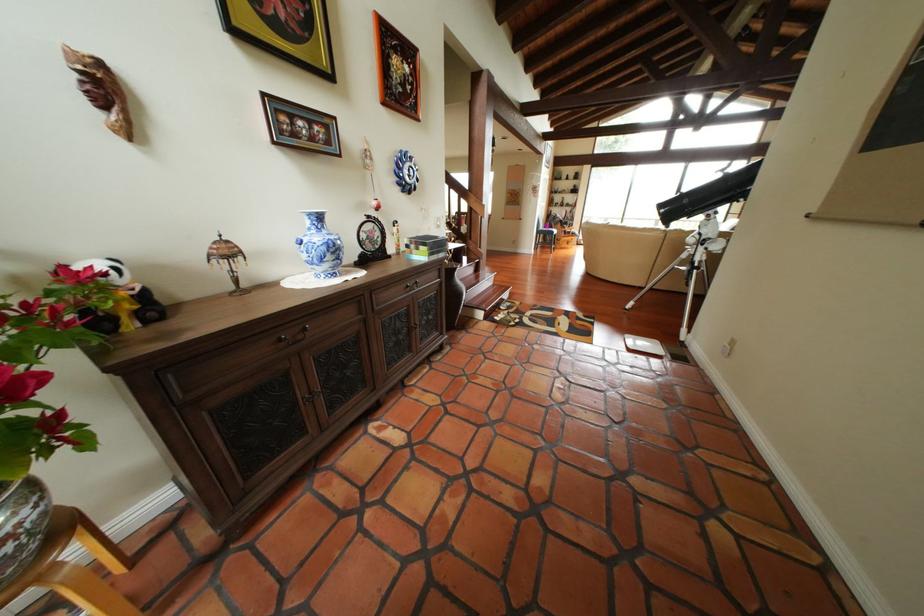
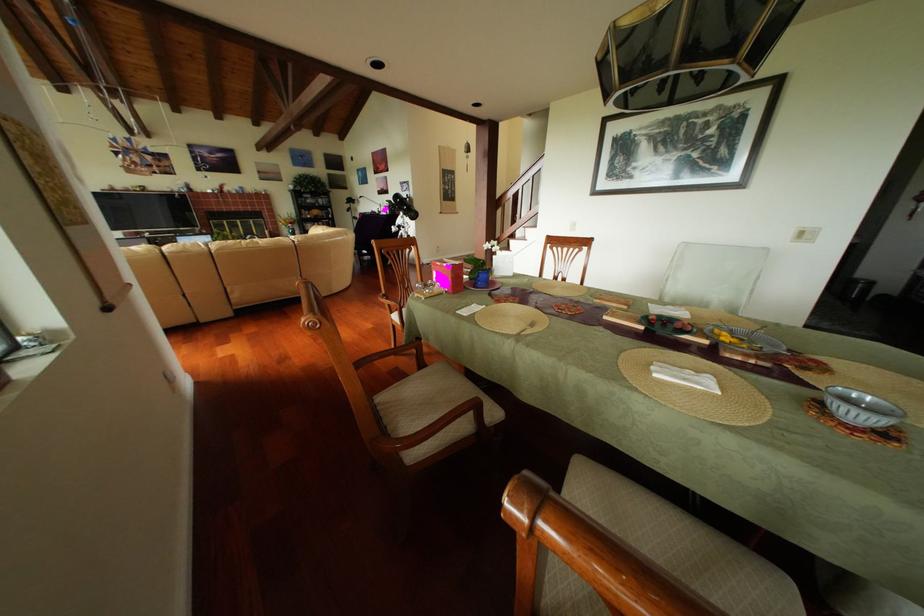
Question: I am providing you with two images of the same scene from different viewpoints. After the viewpoint changes to image2, which objects are now occluded?

Choices:
 (A) dark cabinet knob
 (B) wooden chair armrest
 (C) blue flower pot
 (D) black object case

Answer: (A)